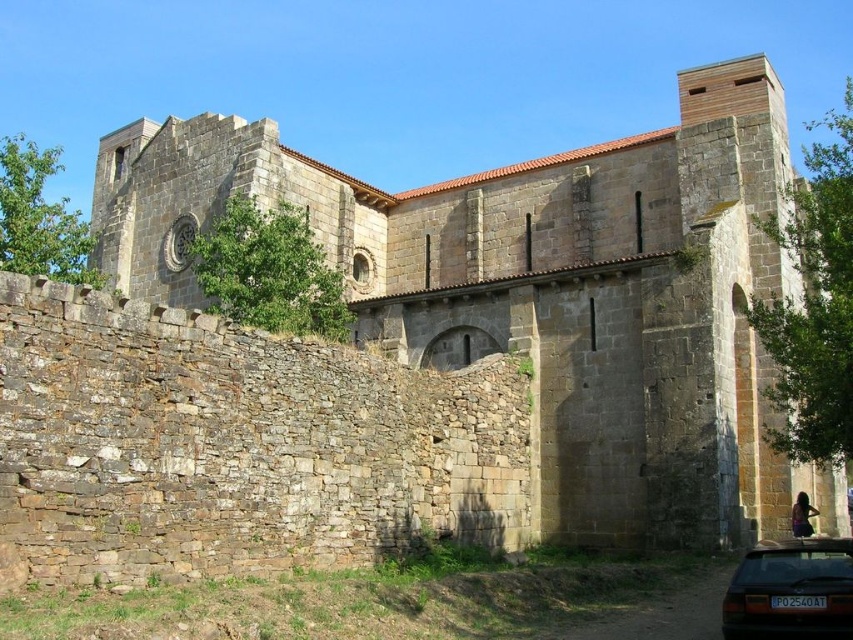
Question: Does stone church at center lie behind dark brown metallic car at lower right?

Choices:
 (A) yes
 (B) no

Answer: (A)

Question: Among these objects, which one is farthest from the camera?

Choices:
 (A) stone church at center
 (B) dark brown metallic car at lower right

Answer: (A)

Question: Does stone church at center have a smaller size compared to dark brown metallic car at lower right?

Choices:
 (A) yes
 (B) no

Answer: (B)

Question: Can you confirm if stone church at center is positioned to the left of dark brown metallic car at lower right?

Choices:
 (A) no
 (B) yes

Answer: (B)

Question: Among these points, which one is nearest to the camera?

Choices:
 (A) (796, 580)
 (B) (160, 196)

Answer: (A)